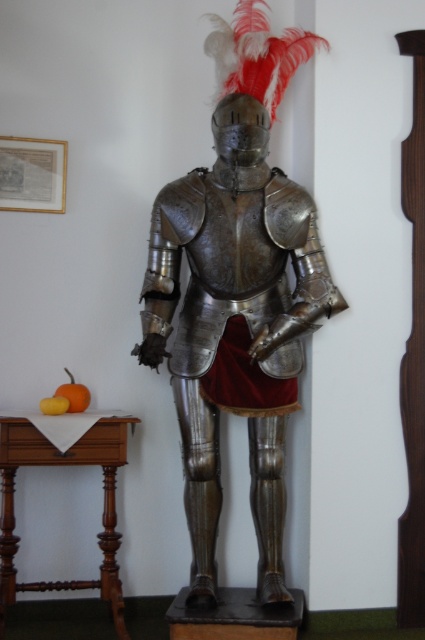
Question: Is shiny metallic armor at center to the left of wooden table at lower left from the viewer's perspective?

Choices:
 (A) yes
 (B) no

Answer: (B)

Question: Among these points, which one is farthest from the camera?

Choices:
 (A) (204, 566)
 (B) (96, 449)

Answer: (A)

Question: Which point is closer to the camera taking this photo?

Choices:
 (A) (209, 230)
 (B) (78, 456)

Answer: (A)

Question: Does shiny metallic armor at center lie behind wooden table at lower left?

Choices:
 (A) no
 (B) yes

Answer: (A)

Question: Can you confirm if shiny metallic armor at center is positioned above wooden table at lower left?

Choices:
 (A) yes
 (B) no

Answer: (A)

Question: Which object appears closest to the camera in this image?

Choices:
 (A) wooden table at lower left
 (B) shiny metallic armor at center

Answer: (B)